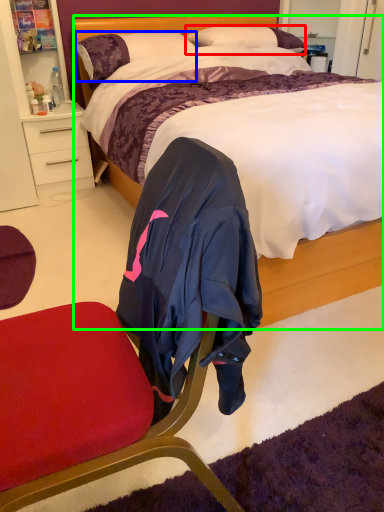
Question: Which object is positioned closest to pillow (highlighted by a red box)? Select from pillow (highlighted by a blue box) and bed (highlighted by a green box).

Choices:
 (A) pillow
 (B) bed

Answer: (A)